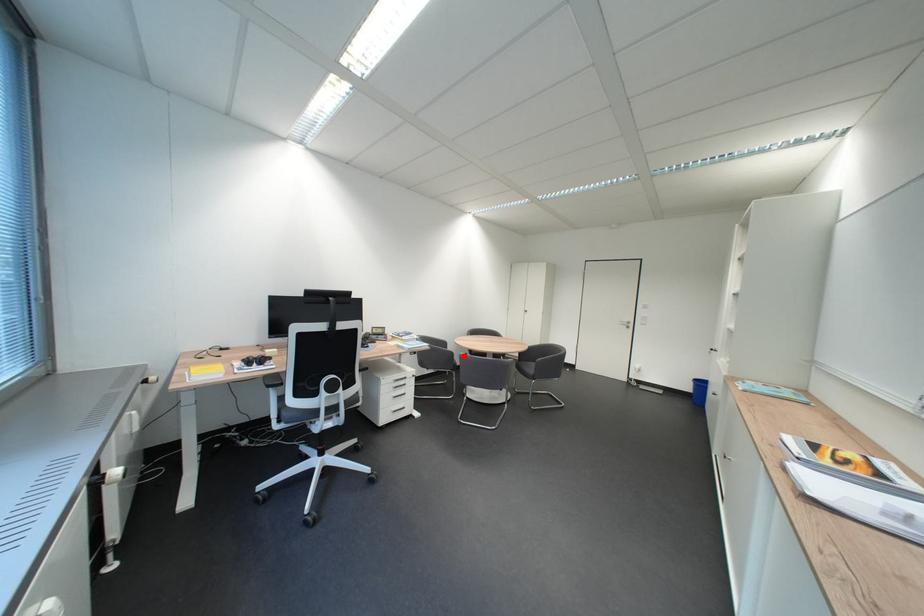
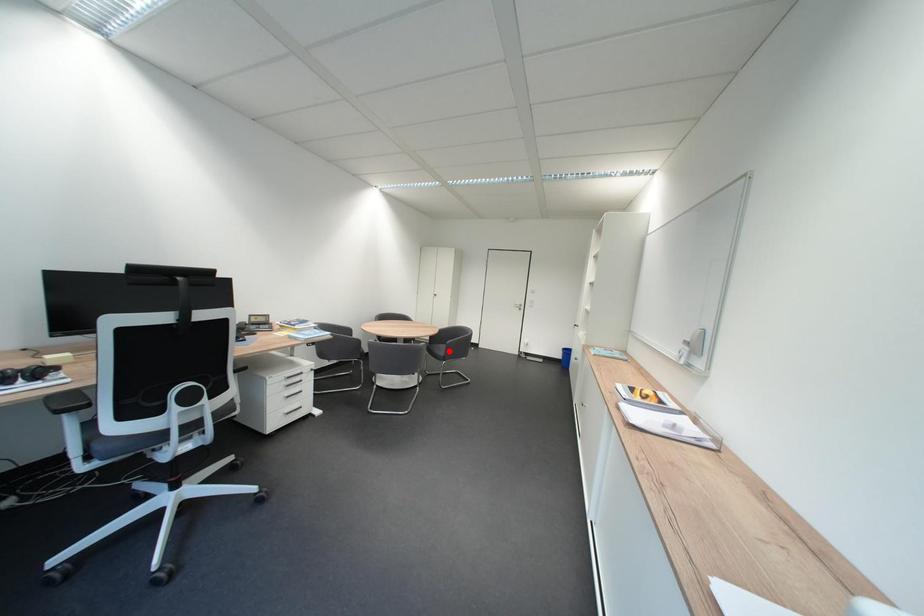
I am providing you with two images of the same scene from different viewpoints. A red point is marked on the first image and another point is marked on the second image. Are the points marked in image1 and image2 representing the same 3D position?

No